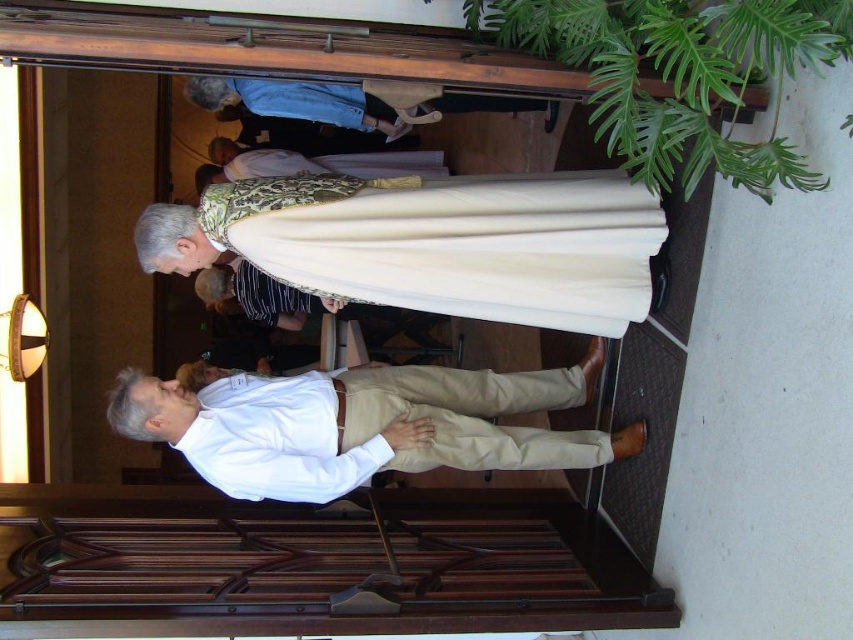
Question: Which object is positioned closest to the gold textured robe at center?

Choices:
 (A) white smooth dress shirt at lower center
 (B) white cotton shirt at center

Answer: (B)

Question: Is white cotton shirt at center wider than gold textured robe at center?

Choices:
 (A) no
 (B) yes

Answer: (B)

Question: Is white smooth dress shirt at lower center smaller than gold textured robe at center?

Choices:
 (A) no
 (B) yes

Answer: (B)

Question: Which object appears closest to the camera in this image?

Choices:
 (A) gold textured robe at center
 (B) white smooth dress shirt at lower center
 (C) white cotton shirt at center

Answer: (B)

Question: Can you confirm if white cotton shirt at center is positioned to the right of gold textured robe at center?

Choices:
 (A) yes
 (B) no

Answer: (A)

Question: Which object is positioned closest to the gold textured robe at center?

Choices:
 (A) white smooth dress shirt at lower center
 (B) white cotton shirt at center

Answer: (B)